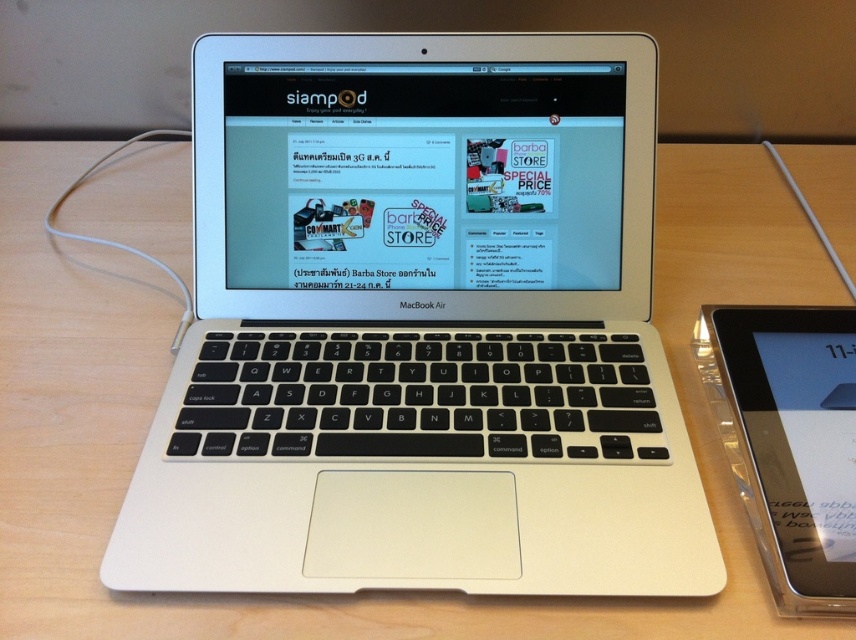
Between silver metallic laptop at center and clear plastic tablet at right, which one appears on the right side from the viewer's perspective?

Positioned to the right is clear plastic tablet at right.

At what (x,y) coordinates should I click in order to perform the action: click on silver metallic laptop at center. Please return your answer as a coordinate pair (x, y). Image resolution: width=856 pixels, height=640 pixels. Looking at the image, I should click on (420, 328).